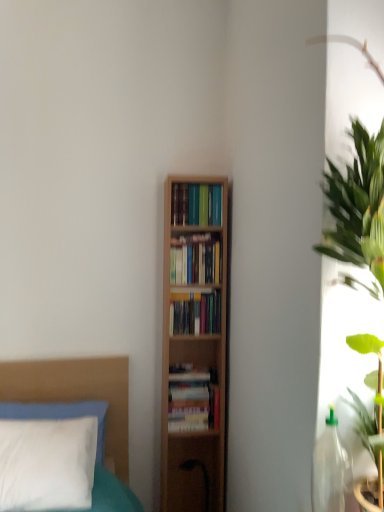
Question: Looking at their shapes, would you say wooden bookshelf at center, marked as the second book in a top-to-bottom arrangement, is wider or thinner than white soft pillow at lower left?

Choices:
 (A) wide
 (B) thin

Answer: (B)

Question: Does point (203, 258) appear closer or farther from the camera than point (105, 422)?

Choices:
 (A) farther
 (B) closer

Answer: (B)

Question: Estimate the real-world distances between objects in this image. Which object is closer to the hardcover books at center, which is the 1th book in top-to-bottom order?

Choices:
 (A) hardcover books at center, the first book positioned from the bottom
 (B) white soft pillow at lower left
 (C) hardcover books at center, which appears as the 2th book when ordered from the bottom
 (D) wooden bookshelf at center, marked as the 3th book in a bottom-to-top arrangement

Answer: (D)

Question: Which is farther from the wooden bookshelf at center, marked as the second book in a top-to-bottom arrangement?

Choices:
 (A) hardcover books at center, which is the 4th book from top to bottom
 (B) white soft pillow at lower left
 (C) hardcover books at center, the 3th book when ordered from top to bottom
 (D) hardcover books at center, acting as the 4th book starting from the bottom

Answer: (B)